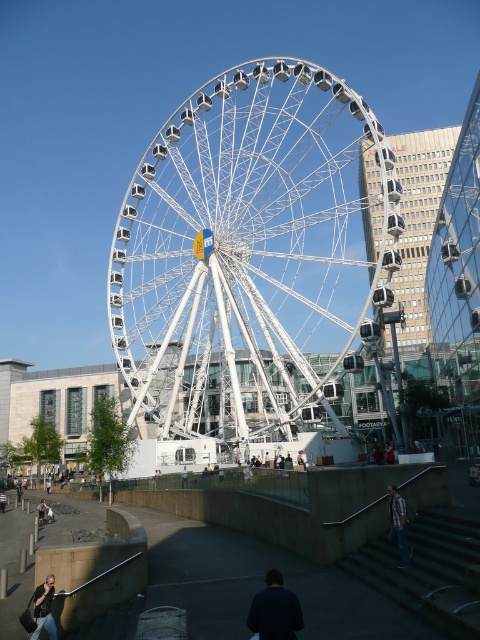
Question: Is plaid shirt at lower right wider than light brown leather jacket at center?

Choices:
 (A) no
 (B) yes

Answer: (A)

Question: Is white metallic ferris wheel at center smaller than dark blue jacket at lower center?

Choices:
 (A) no
 (B) yes

Answer: (A)

Question: Which is nearer to the white metallic ferris wheel at center?

Choices:
 (A) light brown wooden bench at center
 (B) dark blue jacket at lower center

Answer: (A)

Question: Which of the following is the closest to the observer?

Choices:
 (A) plaid shirt at lower right
 (B) light brown leather jacket at center

Answer: (A)

Question: Does white metallic ferris wheel at center appear on the right side of leather jacket at lower left?

Choices:
 (A) yes
 (B) no

Answer: (A)

Question: Which is farther from the leather jacket at lower left?

Choices:
 (A) light brown leather jacket at center
 (B) dark blue jacket at lower center

Answer: (A)